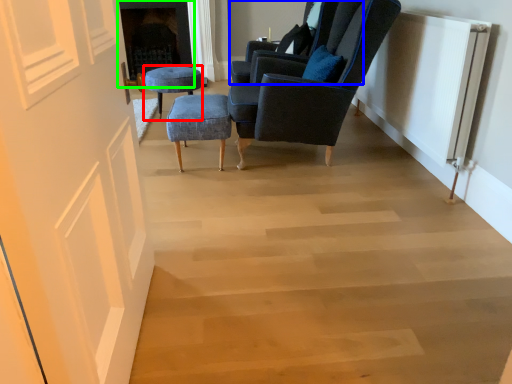
Question: Estimate the real-world distances between objects in this image. Which object is closer to stool (highlighted by a red box), chair (highlighted by a blue box) or fireplace (highlighted by a green box)?

Choices:
 (A) chair
 (B) fireplace

Answer: (A)